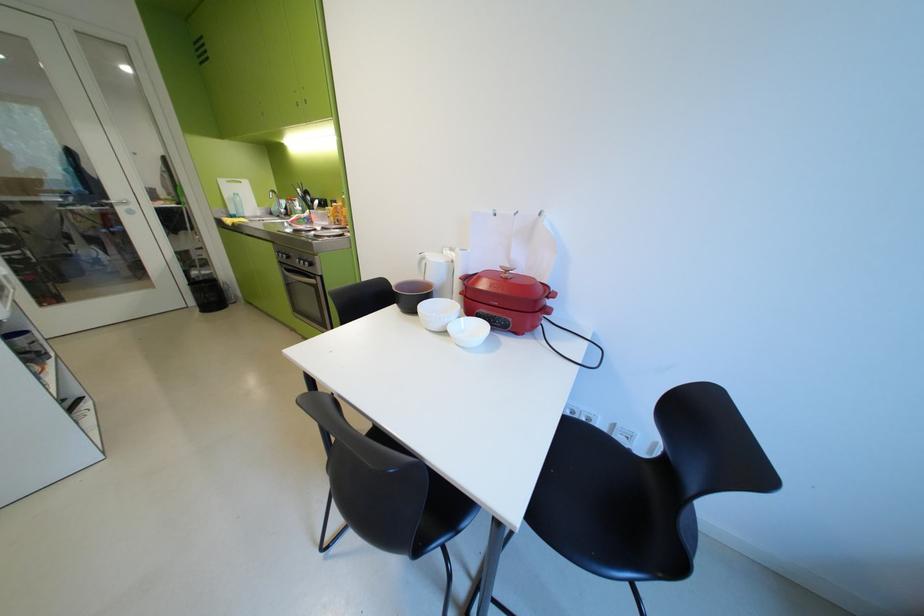
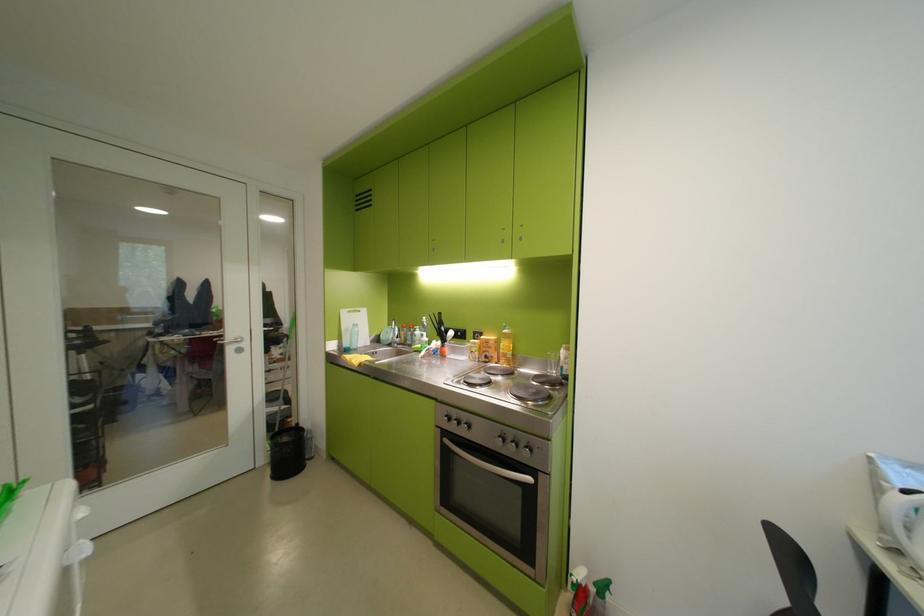
Find the pixel in the second image that matches point 222,297 in the first image.

(299, 453)